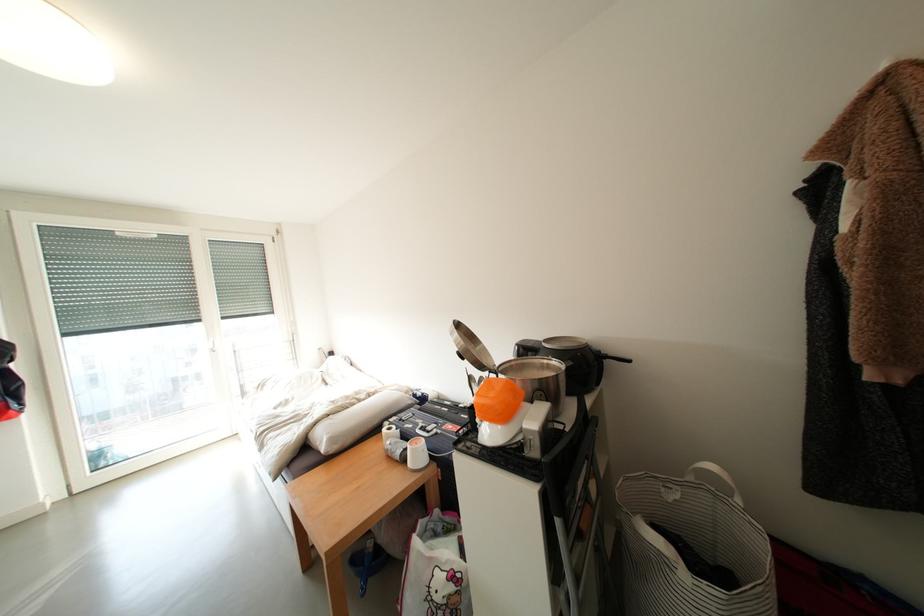
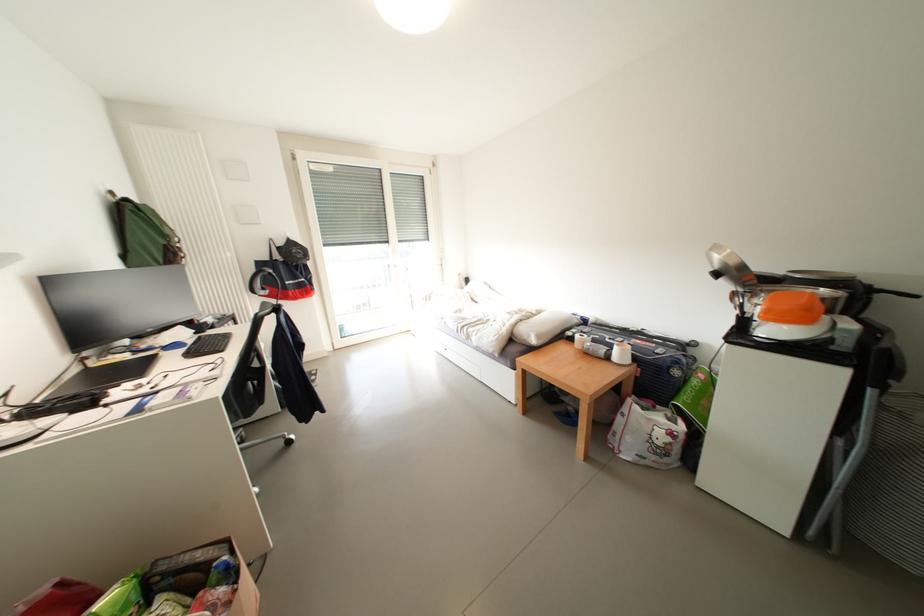
In the second image, find the point that corresponds to (426,434) in the first image.

(614, 342)